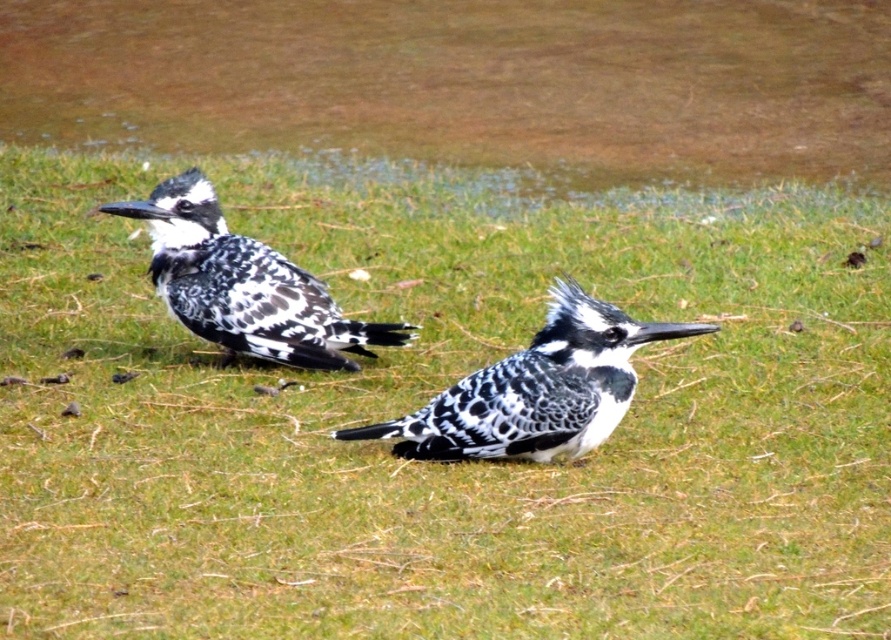
You are a nature photographer aiming to capture a closeup shot of the speckled feathers bird at center and the speckled feathered bird at left. Based on their positions, which bird should you focus on first to ensure it appears sharp in your photo?

The speckled feathers bird at center is closer to the viewer than the speckled feathered bird at left, so you should focus on the speckled feathers bird at center first to ensure it appears sharp in your photo.